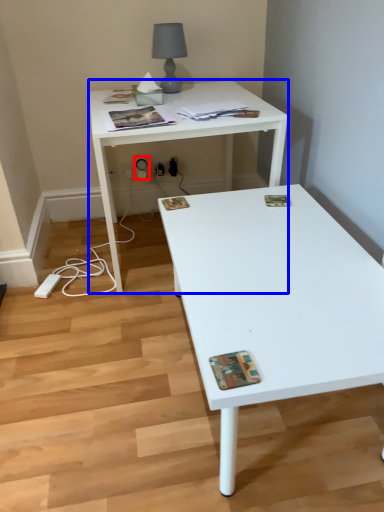
Question: Among these objects, which one is nearest to the camera, electric outlet (highlighted by a red box) or desk (highlighted by a blue box)?

Choices:
 (A) electric outlet
 (B) desk

Answer: (B)